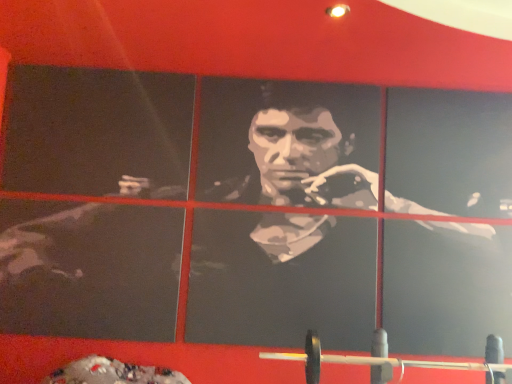
What do you see at coordinates (394, 360) in the screenshot? I see `silver metallic barbell at lower center` at bounding box center [394, 360].

The image size is (512, 384). I want to click on silver metallic barbell at lower center, so click(394, 360).

At what (x,y) coordinates should I click in order to perform the action: click on silver metallic barbell at lower center. Please return your answer as a coordinate pair (x, y). This screenshot has height=384, width=512. Looking at the image, I should click on (394, 360).